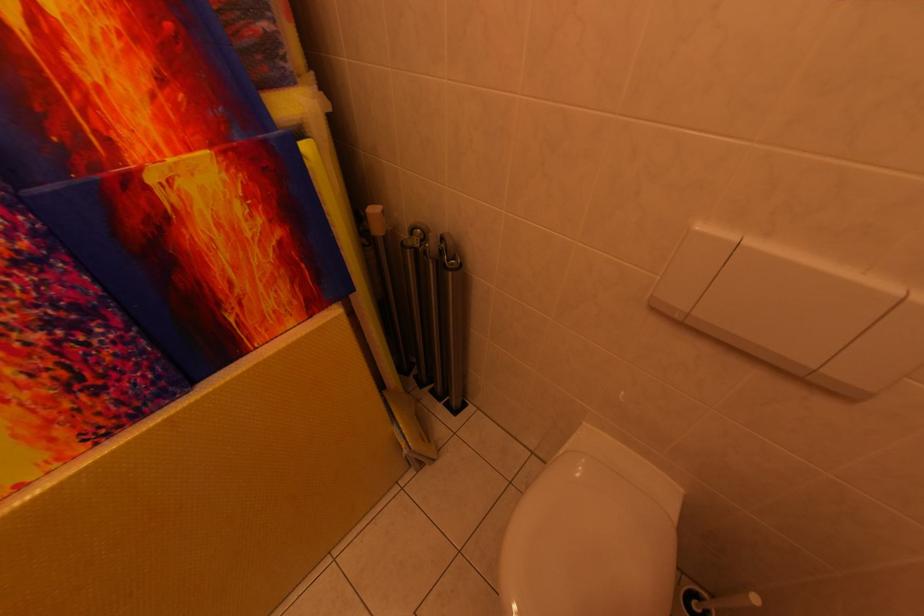
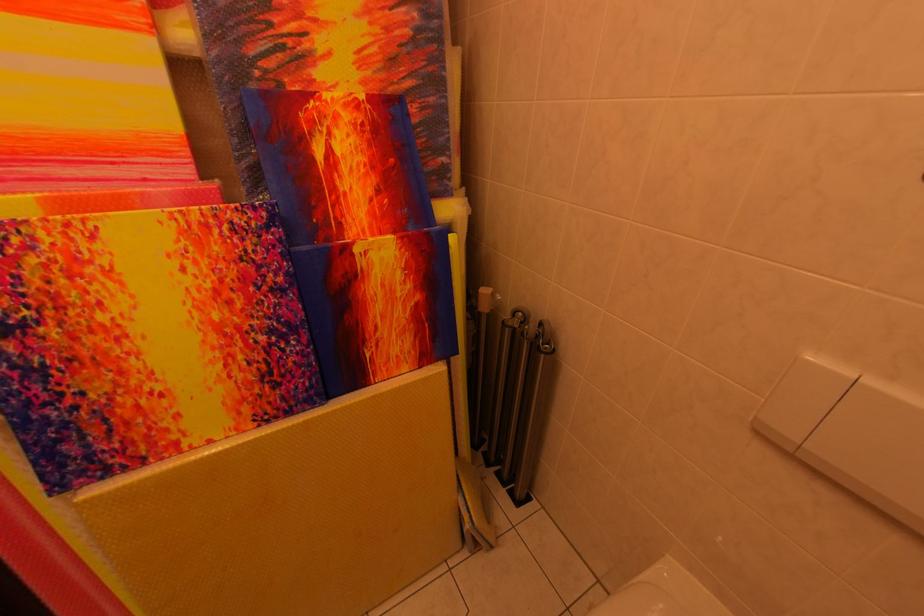
Question: Which direction would the cameraman need to move to produce the second image? Reply with the corresponding letter.

Choices:
 (A) Left
 (B) Right
 (C) Forward
 (D) Backward

Answer: (D)